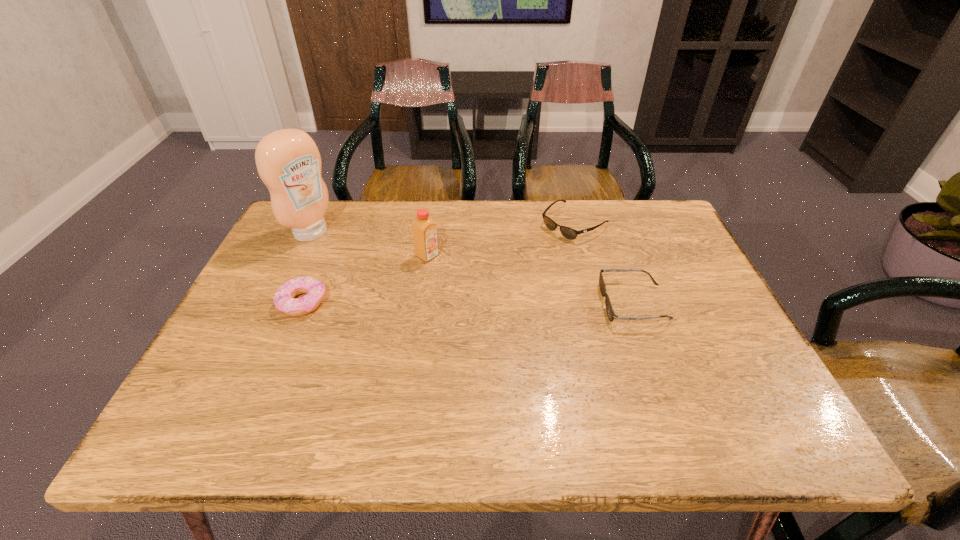
Locate an element on the screen. The height and width of the screenshot is (540, 960). condiment at the far edge is located at coordinates (288, 161).

This screenshot has width=960, height=540. Identify the location of doughnut that is at the left edge. (314, 289).

At what (x,y) coordinates should I click in order to perform the action: click on condiment that is at the left edge. Please return your answer as a coordinate pair (x, y). Looking at the image, I should click on (288, 161).

Locate an element on the screen. The image size is (960, 540). object present at the right edge is located at coordinates (611, 315).

Where is `object located in the far left corner section of the desktop`? This screenshot has height=540, width=960. object located in the far left corner section of the desktop is located at coordinates (288, 161).

Find the location of a particular element. The height and width of the screenshot is (540, 960). free space at the far edge of the desktop is located at coordinates (413, 204).

You are a GUI agent. You are given a task and a screenshot of the screen. Output one action in this format:
    pyautogui.click(x=<x>, y=<y>)
    Task: Click on the vacant space at the near edge of the desktop
    
    Given the screenshot: What is the action you would take?
    pyautogui.click(x=451, y=375)

This screenshot has height=540, width=960. I want to click on free space at the left edge of the desktop, so click(278, 354).

At what (x,y) coordinates should I click in order to perform the action: click on vacant area at the far left corner. Please return your answer as a coordinate pair (x, y). Looking at the image, I should click on (283, 229).

Find the location of a particular element. The image size is (960, 540). vacant space at the near left corner of the desktop is located at coordinates (241, 399).